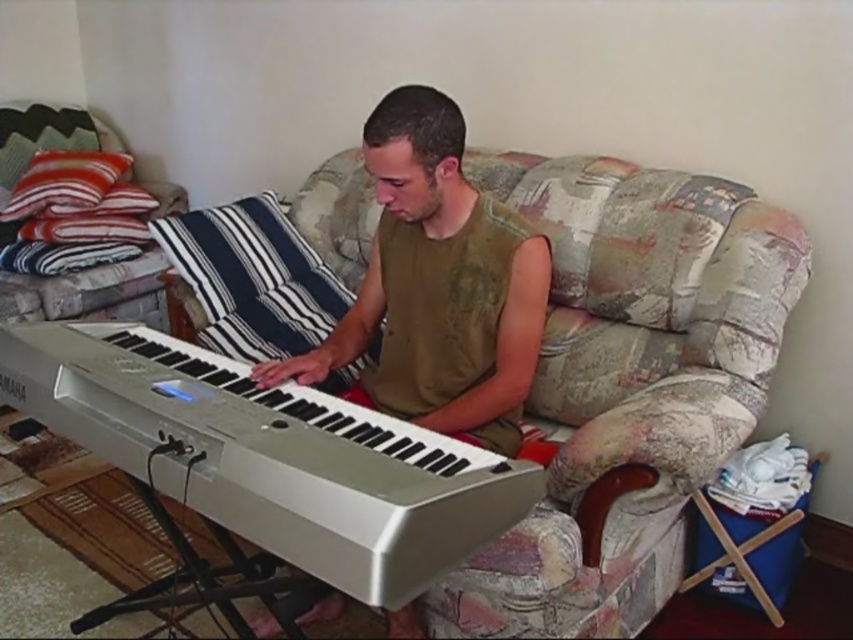
Question: Can you confirm if patterned fabric couch at center is positioned to the left of white plastic keyboard at center?

Choices:
 (A) yes
 (B) no

Answer: (B)

Question: Can you confirm if white plastic keyboard at center is thinner than matte green tank top at center?

Choices:
 (A) no
 (B) yes

Answer: (A)

Question: Based on their relative distances, which object is farther from the patterned fabric couch at center?

Choices:
 (A) striped fabric pillow at upper left
 (B) matte green tank top at center

Answer: (A)

Question: Estimate the real-world distances between objects in this image. Which object is farther from the striped fabric pillow at upper left?

Choices:
 (A) white plastic keyboard at center
 (B) matte green tank top at center

Answer: (B)

Question: Which point is farther to the camera?

Choices:
 (A) (387, 104)
 (B) (631, 180)

Answer: (B)

Question: Does white plastic keyboard at center have a greater width compared to matte green tank top at center?

Choices:
 (A) yes
 (B) no

Answer: (A)